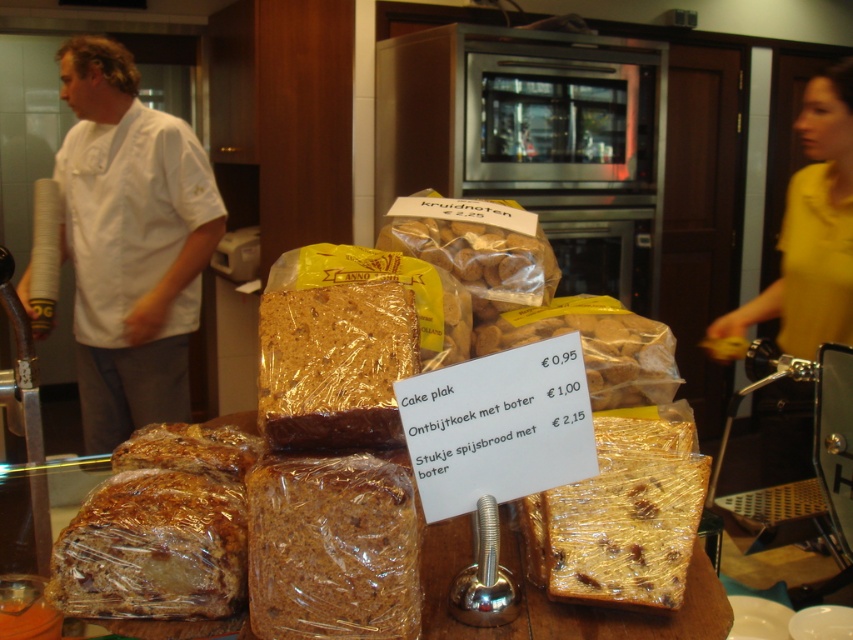
Question: Which point is farther to the camera?

Choices:
 (A) translucent plastic bread at center
 (B) translucent brown bread at lower left
 (C) white chef coat at left

Answer: (C)

Question: Can you confirm if white chef coat at left is smaller than translucent brown bread at lower left?

Choices:
 (A) no
 (B) yes

Answer: (A)

Question: Does translucent plastic cake at center appear under yellow fabric shirt at right?

Choices:
 (A) yes
 (B) no

Answer: (A)

Question: Which object appears closest to the camera in this image?

Choices:
 (A) yellow fabric shirt at right
 (B) translucent brown bread at lower left
 (C) translucent plastic cake at center
 (D) white chef coat at left

Answer: (C)

Question: Which of the following is the closest to the observer?

Choices:
 (A) translucent plastic bread at center
 (B) yellow fabric shirt at right
 (C) white chef coat at left
 (D) translucent plastic cake at center

Answer: (A)

Question: Is white chef coat at left closer to the viewer compared to translucent brown bread at lower left?

Choices:
 (A) yes
 (B) no

Answer: (B)